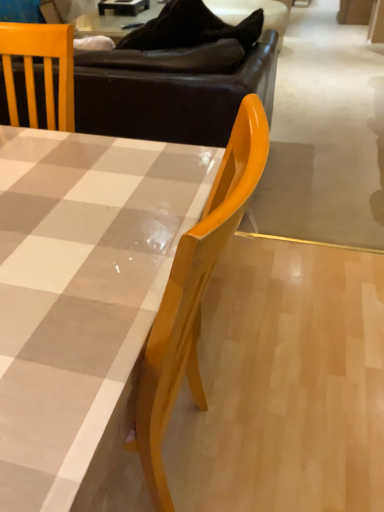
Describe the element at coordinates (170, 96) in the screenshot. I see `brown leather couch at upper center` at that location.

At what (x,y) coordinates should I click in order to perform the action: click on brown leather couch at upper center. Please return your answer as a coordinate pair (x, y). Image resolution: width=384 pixels, height=512 pixels. Looking at the image, I should click on (170, 96).

This screenshot has width=384, height=512. What do you see at coordinates (81, 297) in the screenshot?
I see `matte checkered table at center` at bounding box center [81, 297].

You are a GUI agent. You are given a task and a screenshot of the screen. Output one action in this format:
    pyautogui.click(x=<x>, y=<y>)
    Task: Click on the matte checkered table at center
    Image resolution: width=384 pixels, height=512 pixels.
    Given the screenshot: What is the action you would take?
    pyautogui.click(x=81, y=297)

The image size is (384, 512). What are the coordinates of `brown leather couch at upper center` in the screenshot? It's located at (170, 96).

Considering the positions of objects matte checkered table at center and brown leather couch at upper center in the image provided, who is more to the right, matte checkered table at center or brown leather couch at upper center?

brown leather couch at upper center.

Is matte checkered table at center in front of or behind brown leather couch at upper center in the image?

matte checkered table at center is positioned closer to the viewer than brown leather couch at upper center.

Considering the points (82, 349) and (41, 124), which point is in front, point (82, 349) or point (41, 124)?

The point (82, 349) is closer to the camera.

From the image's perspective, is matte checkered table at center positioned above or below brown leather couch at upper center?

Clearly, from the image's perspective, matte checkered table at center is below brown leather couch at upper center.

From a real-world perspective, is matte checkered table at center physically below brown leather couch at upper center?

Yes, from a real-world perspective, matte checkered table at center is beneath brown leather couch at upper center.

Which object is thinner, matte checkered table at center or brown leather couch at upper center?

Thinner between the two is matte checkered table at center.

Can you confirm if matte checkered table at center is shorter than brown leather couch at upper center?

Indeed, matte checkered table at center has a lesser height compared to brown leather couch at upper center.

Does matte checkered table at center have a larger size compared to brown leather couch at upper center?

No, matte checkered table at center is not bigger than brown leather couch at upper center.

Is matte checkered table at center located outside brown leather couch at upper center?

That's correct, matte checkered table at center is outside of brown leather couch at upper center.

Is matte checkered table at center next to brown leather couch at upper center?

No, matte checkered table at center is not making contact with brown leather couch at upper center.

Is brown leather couch at upper center at the back of matte checkered table at center?

Yes, matte checkered table at center is positioned with its back facing brown leather couch at upper center.

I want to click on table in front of the brown leather couch at upper center, so click(x=81, y=297).

Looking at this image, does brown leather couch at upper center appear on the left side of matte checkered table at center?

No, brown leather couch at upper center is not to the left of matte checkered table at center.

Which is behind, brown leather couch at upper center or matte checkered table at center?

brown leather couch at upper center is more distant.

Is point (199, 117) positioned after point (7, 319)?

Yes, it is behind point (7, 319).

From the image's perspective, which object appears higher, brown leather couch at upper center or matte checkered table at center?

brown leather couch at upper center.

From a real-world perspective, does brown leather couch at upper center stand above matte checkered table at center?

Correct, in the physical world, brown leather couch at upper center is higher than matte checkered table at center.

Considering the sizes of objects brown leather couch at upper center and matte checkered table at center in the image provided, who is wider, brown leather couch at upper center or matte checkered table at center?

Wider between the two is brown leather couch at upper center.

Considering the sizes of objects brown leather couch at upper center and matte checkered table at center in the image provided, who is taller, brown leather couch at upper center or matte checkered table at center?

With more height is brown leather couch at upper center.

Is brown leather couch at upper center smaller than matte checkered table at center?

Incorrect, brown leather couch at upper center is not smaller in size than matte checkered table at center.

Can we say brown leather couch at upper center lies outside matte checkered table at center?

Indeed, brown leather couch at upper center is completely outside matte checkered table at center.

Are brown leather couch at upper center and matte checkered table at center located far from each other?

Actually, brown leather couch at upper center and matte checkered table at center are a little close together.

Is brown leather couch at upper center facing towards matte checkered table at center?

No, brown leather couch at upper center is not oriented towards matte checkered table at center.

What are the coordinates of `table below the brown leather couch at upper center (from a real-world perspective)` in the screenshot? It's located at (81, 297).

Locate an element on the screen. The height and width of the screenshot is (512, 384). table on the left of brown leather couch at upper center is located at coordinates (81, 297).

Image resolution: width=384 pixels, height=512 pixels. In the image, there is a matte checkered table at center. What are the coordinates of `studio couch above it (from the image's perspective)` in the screenshot? It's located at (170, 96).